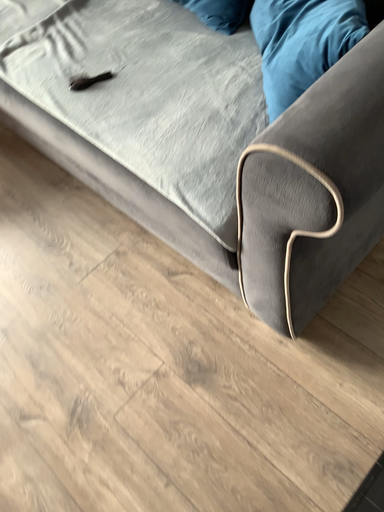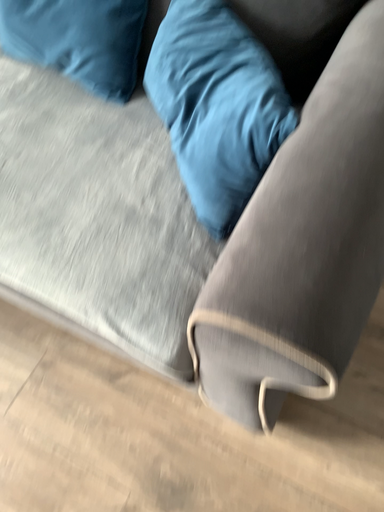
Question: Which way did the camera rotate in the video?

Choices:
 (A) rotated left
 (B) rotated right

Answer: (B)